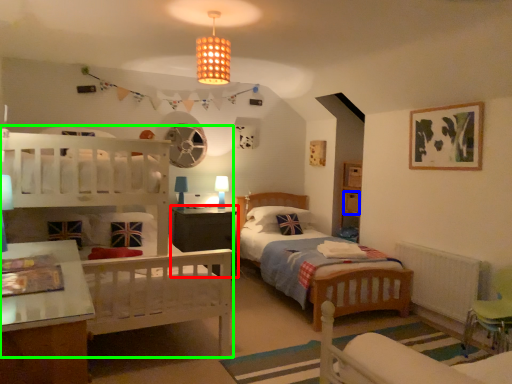
Question: Which object is positioned farthest from nightstand (highlighted by a red box)? Select from drawer (highlighted by a blue box) and bunk bed (highlighted by a green box).

Choices:
 (A) drawer
 (B) bunk bed

Answer: (A)